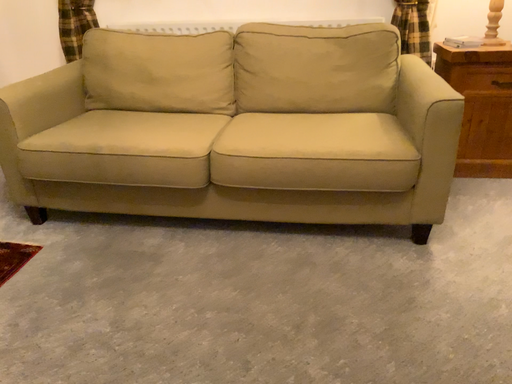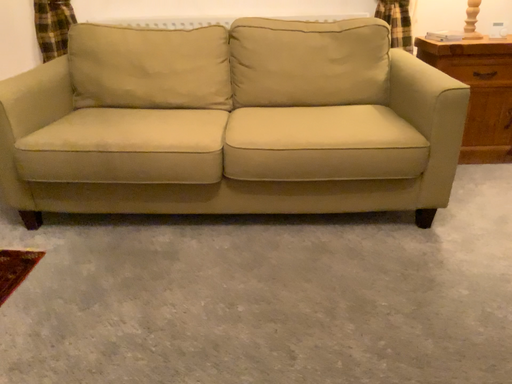
Question: How did the camera likely rotate when shooting the video?

Choices:
 (A) rotated left
 (B) rotated right

Answer: (B)